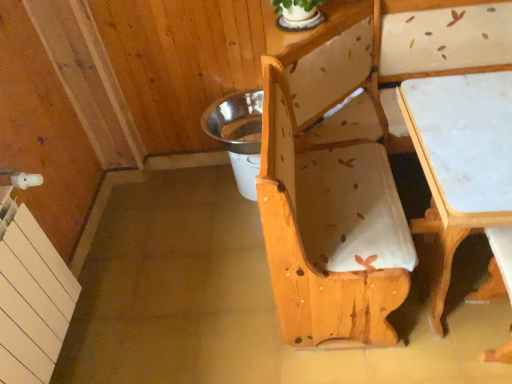
The width and height of the screenshot is (512, 384). What are the coordinates of `free space that is to the left of natural wood bench at center` in the screenshot? It's located at (188, 276).